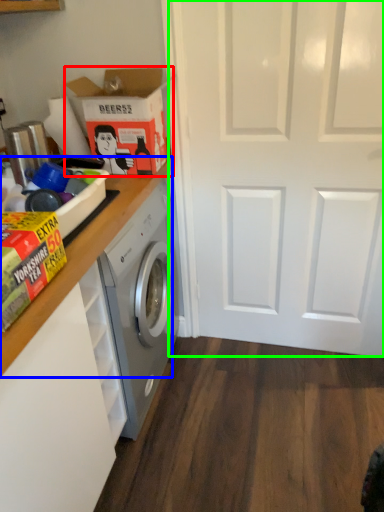
Question: Based on their relative distances, which object is farther from cardboard box (highlighted by a red box)? Choose from counter top (highlighted by a blue box) and screen door (highlighted by a green box).

Choices:
 (A) counter top
 (B) screen door

Answer: (B)